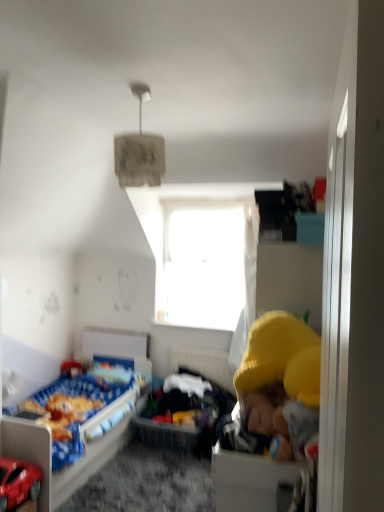
You are a GUI agent. You are given a task and a screenshot of the screen. Output one action in this format:
    pyautogui.click(x=<x>, y=<y>)
    Task: Click on the vacant space underneath transparent glass window at center (from a real-world perspective)
    The image size is (384, 512).
    Given the screenshot: What is the action you would take?
    pyautogui.click(x=184, y=319)